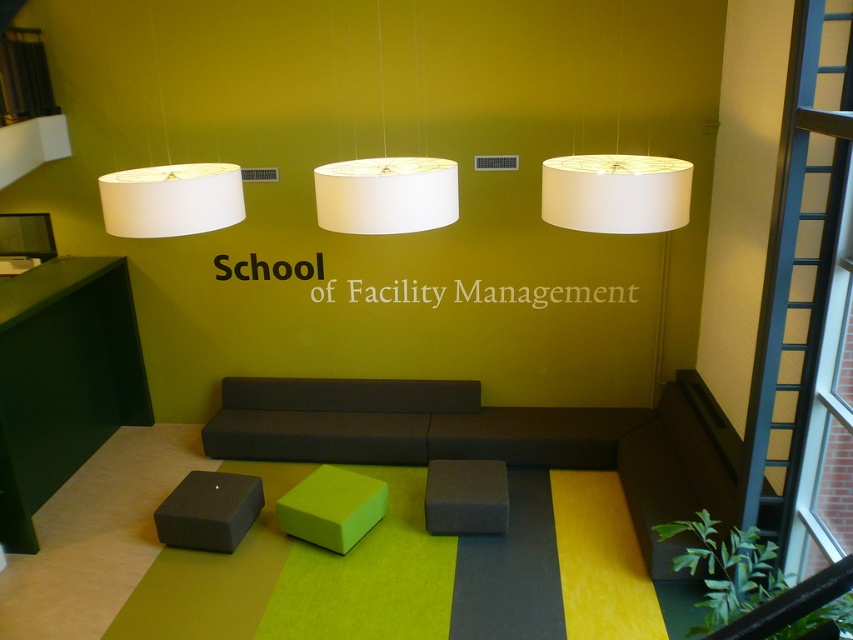
Question: Among these points, which one is nearest to the camera?

Choices:
 (A) (112, 193)
 (B) (463, 500)
 (C) (169, 544)
 (D) (416, 179)

Answer: (D)

Question: Is matte gray stool at lower left to the left of matte gray stool at center from the viewer's perspective?

Choices:
 (A) yes
 (B) no

Answer: (A)

Question: Can you confirm if white matte lampshade at upper right is thinner than green foam stool at center?

Choices:
 (A) yes
 (B) no

Answer: (B)

Question: Which object is the farthest from the white matte lampshade at upper center?

Choices:
 (A) matte gray stool at center
 (B) matte gray stool at lower left

Answer: (A)

Question: Is dark gray fabric couch at center to the right of green foam stool at center from the viewer's perspective?

Choices:
 (A) yes
 (B) no

Answer: (B)

Question: Estimate the real-world distances between objects in this image. Which object is farther from the white matte lampshade at upper center?

Choices:
 (A) matte gray stool at center
 (B) dark gray fabric couch at center
 (C) white matte lampshade at center

Answer: (A)